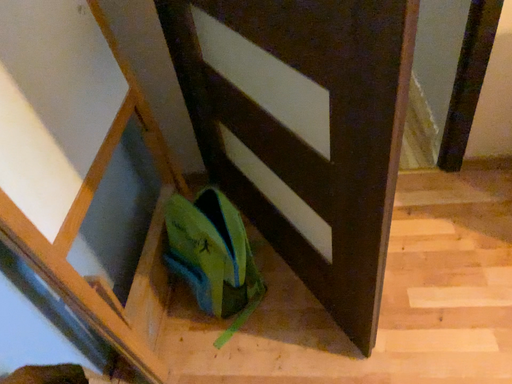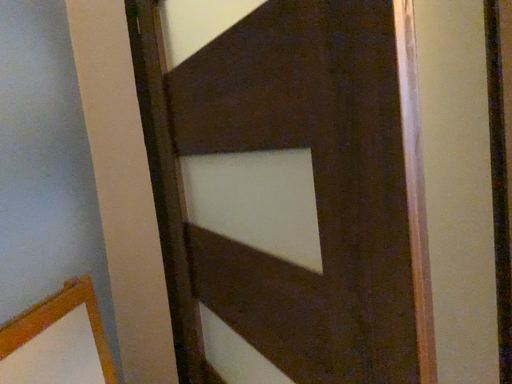
Question: How did the camera likely rotate when shooting the video?

Choices:
 (A) rotated downward
 (B) rotated upward

Answer: (B)